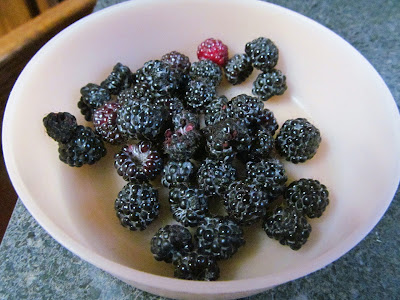
Locate an element on the screen. green counter below bowl is located at coordinates (44, 273).